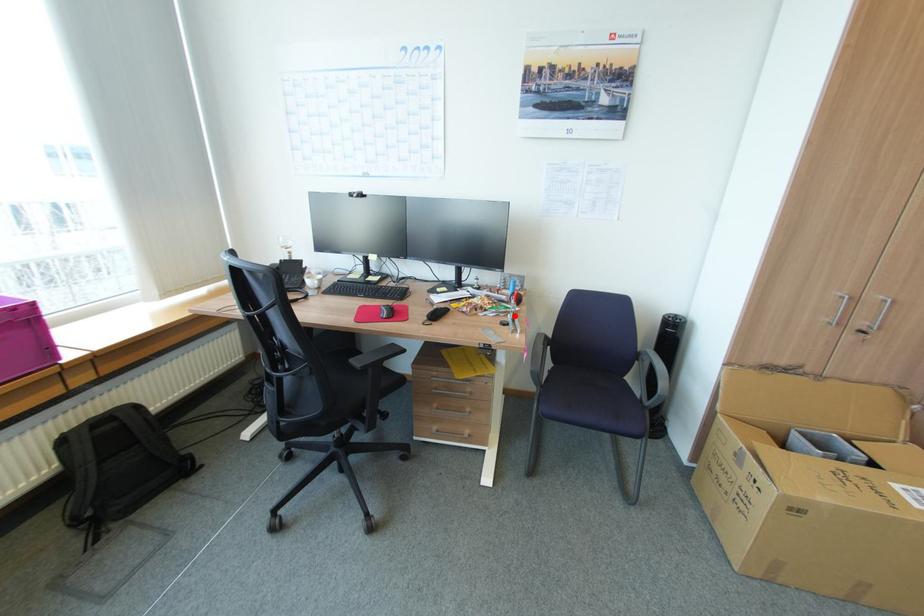
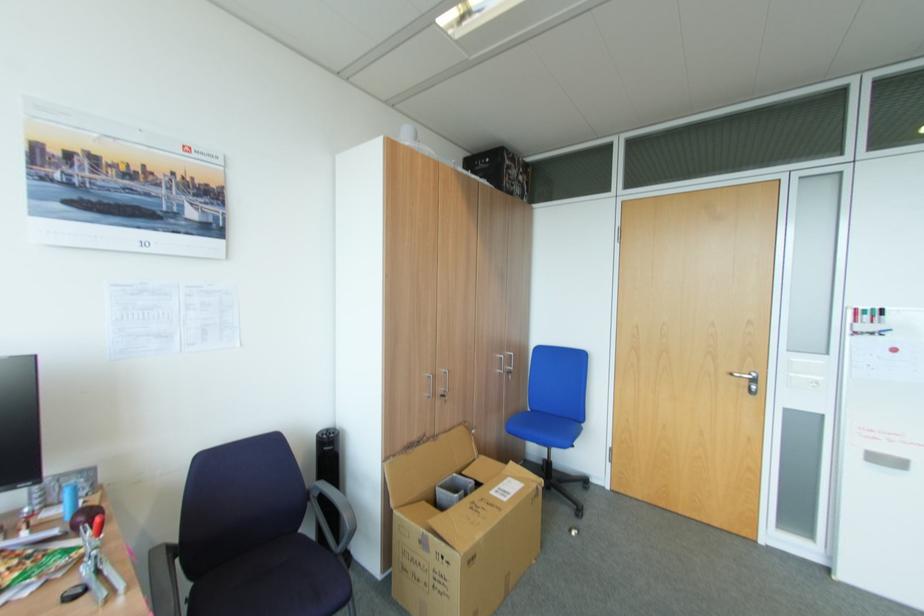
In the second image, find the point that corresponds to the highlighted location in the first image.

(91, 569)